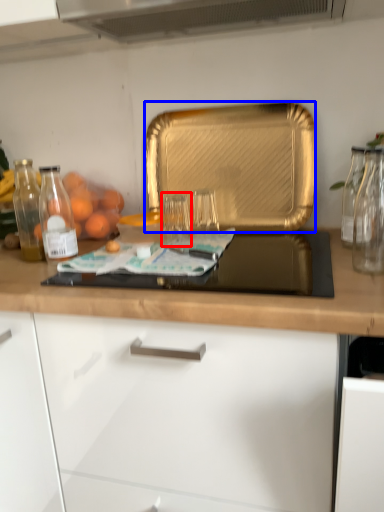
Question: Which object appears closest to the camera in this image, glass jar (highlighted by a red box) or kitchen appliance (highlighted by a blue box)?

Choices:
 (A) glass jar
 (B) kitchen appliance

Answer: (A)